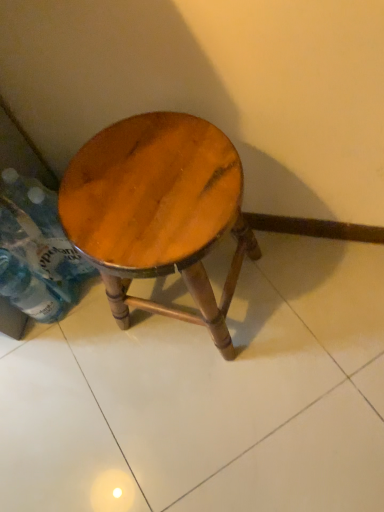
Question: From the image's perspective, is translucent plastic bottle at lower left, placed as the 1th bottle when sorted from top to bottom, above clear plastic bottle at lower left, the second bottle positioned from the top?

Choices:
 (A) no
 (B) yes

Answer: (B)

Question: Considering the relative positions of translucent plastic bottle at lower left, which is counted as the second bottle, starting from the bottom, and clear plastic bottle at lower left, the second bottle positioned from the top, in the image provided, is translucent plastic bottle at lower left, which is counted as the second bottle, starting from the bottom, behind clear plastic bottle at lower left, the second bottle positioned from the top,?

Choices:
 (A) no
 (B) yes

Answer: (B)

Question: Is clear plastic bottle at lower left, the 1th bottle when ordered from bottom to top, at the back of translucent plastic bottle at lower left, which is counted as the second bottle, starting from the bottom?

Choices:
 (A) yes
 (B) no

Answer: (A)

Question: Can you confirm if translucent plastic bottle at lower left, which is counted as the second bottle, starting from the bottom, is shorter than clear plastic bottle at lower left, the second bottle positioned from the top?

Choices:
 (A) no
 (B) yes

Answer: (B)

Question: From a real-world perspective, is translucent plastic bottle at lower left, which is counted as the second bottle, starting from the bottom, positioned over clear plastic bottle at lower left, the second bottle positioned from the top, based on gravity?

Choices:
 (A) yes
 (B) no

Answer: (B)

Question: Could you tell me if translucent plastic bottle at lower left, which is counted as the second bottle, starting from the bottom, is turned towards clear plastic bottle at lower left, the second bottle positioned from the top?

Choices:
 (A) yes
 (B) no

Answer: (A)

Question: From the image's perspective, does wooden stool at center appear lower than clear plastic bottle at lower left, the second bottle positioned from the top?

Choices:
 (A) yes
 (B) no

Answer: (B)

Question: Is wooden stool at center further to the viewer compared to clear plastic bottle at lower left, the 1th bottle when ordered from bottom to top?

Choices:
 (A) yes
 (B) no

Answer: (B)

Question: Is wooden stool at center shorter than clear plastic bottle at lower left, the 1th bottle when ordered from bottom to top?

Choices:
 (A) yes
 (B) no

Answer: (B)

Question: From a real-world perspective, does wooden stool at center sit lower than clear plastic bottle at lower left, the 1th bottle when ordered from bottom to top?

Choices:
 (A) no
 (B) yes

Answer: (A)

Question: From the image's perspective, would you say wooden stool at center is positioned over clear plastic bottle at lower left, the 1th bottle when ordered from bottom to top?

Choices:
 (A) no
 (B) yes

Answer: (B)

Question: Is wooden stool at center outside clear plastic bottle at lower left, the second bottle positioned from the top?

Choices:
 (A) yes
 (B) no

Answer: (A)

Question: Could you tell me if clear plastic bottle at lower left, the 1th bottle when ordered from bottom to top, is facing wooden stool at center?

Choices:
 (A) no
 (B) yes

Answer: (A)